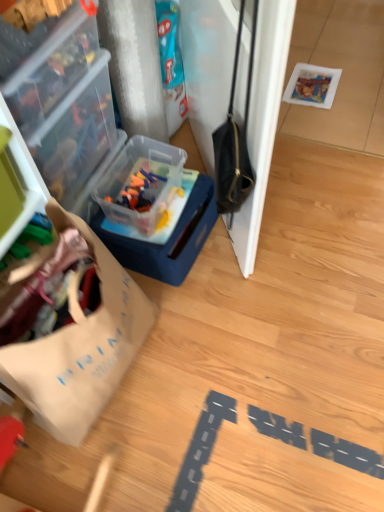
Question: Is brown paper bag at left facing away from transparent plastic container at upper left, marked as the 1th box in a left-to-right arrangement?

Choices:
 (A) yes
 (B) no

Answer: (B)

Question: Are brown paper bag at left and transparent plastic container at upper left, acting as the second box starting from the right, beside each other?

Choices:
 (A) yes
 (B) no

Answer: (B)

Question: From a real-world perspective, is brown paper bag at left located higher than transparent plastic container at upper left, marked as the 1th box in a left-to-right arrangement?

Choices:
 (A) no
 (B) yes

Answer: (A)

Question: Is brown paper bag at left outside of transparent plastic container at upper left, marked as the 1th box in a left-to-right arrangement?

Choices:
 (A) no
 (B) yes

Answer: (B)

Question: From the image's perspective, does brown paper bag at left appear higher than transparent plastic container at upper left, marked as the 1th box in a left-to-right arrangement?

Choices:
 (A) yes
 (B) no

Answer: (B)

Question: Does brown paper bag at left appear on the right side of transparent plastic container at upper left, acting as the second box starting from the right?

Choices:
 (A) no
 (B) yes

Answer: (B)

Question: Can you confirm if wooden floor at lower center is bigger than translucent plastic container at center-left, the 2th box from the left?

Choices:
 (A) yes
 (B) no

Answer: (A)

Question: Would you consider wooden floor at lower center to be distant from translucent plastic container at center-left, which appears as the 1th box when viewed from the right?

Choices:
 (A) no
 (B) yes

Answer: (A)

Question: From the image's perspective, is wooden floor at lower center on translucent plastic container at center-left, which appears as the 1th box when viewed from the right?

Choices:
 (A) yes
 (B) no

Answer: (B)

Question: From a real-world perspective, is wooden floor at lower center on top of translucent plastic container at center-left, which appears as the 1th box when viewed from the right?

Choices:
 (A) yes
 (B) no

Answer: (B)

Question: Is wooden floor at lower center wider than translucent plastic container at center-left, the 2th box from the left?

Choices:
 (A) yes
 (B) no

Answer: (A)

Question: Is wooden floor at lower center aimed at translucent plastic container at center-left, the 2th box from the left?

Choices:
 (A) yes
 (B) no

Answer: (B)

Question: Considering the relative sizes of wooden floor at lower center and transparent plastic container at upper left, acting as the second box starting from the right, in the image provided, is wooden floor at lower center taller than transparent plastic container at upper left, acting as the second box starting from the right,?

Choices:
 (A) no
 (B) yes

Answer: (A)